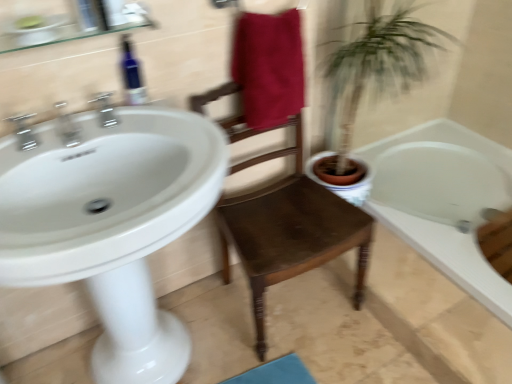
Where is `vacant space behind chrome metallic faucet at upper left, acting as the 2th tap starting from the right`? This screenshot has width=512, height=384. vacant space behind chrome metallic faucet at upper left, acting as the 2th tap starting from the right is located at coordinates (83, 130).